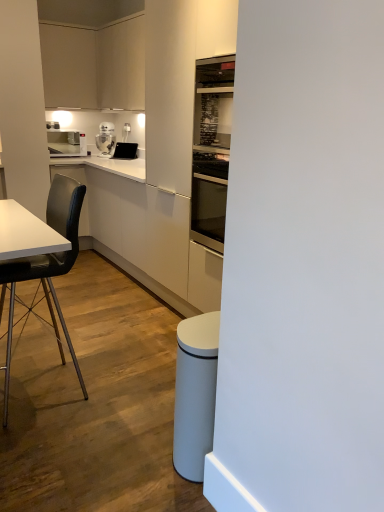
Question: In terms of width, does white glossy robot at upper center, arranged as the 2th kitchen appliance when viewed from the left, look wider or thinner when compared to white glossy counter at center?

Choices:
 (A) thin
 (B) wide

Answer: (A)

Question: From a real-world perspective, is white glossy robot at upper center, acting as the first kitchen appliance starting from the right, physically located above or below white glossy counter at center?

Choices:
 (A) above
 (B) below

Answer: (A)

Question: Which is nearer to the white glossy robot at upper center, acting as the first kitchen appliance starting from the right?

Choices:
 (A) matte black tablet at upper center
 (B) matte white cabinet at upper left
 (C) black matte chair at left
 (D) white glossy toaster at upper left, acting as the 2th kitchen appliance starting from the right
 (E) white glossy counter at center

Answer: (A)

Question: Considering the real-world distances, which object is farthest from the black matte chair at left?

Choices:
 (A) matte white cabinet at upper left
 (B) white glossy counter at center
 (C) matte black tablet at upper center
 (D) white glossy robot at upper center, acting as the first kitchen appliance starting from the right
 (E) white glossy toaster at upper left, acting as the 2th kitchen appliance starting from the right

Answer: (A)